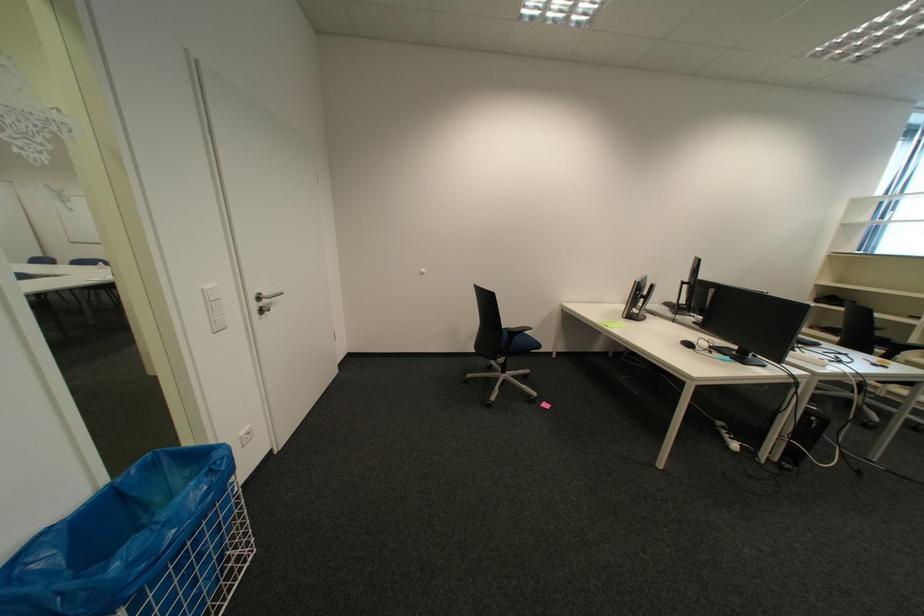
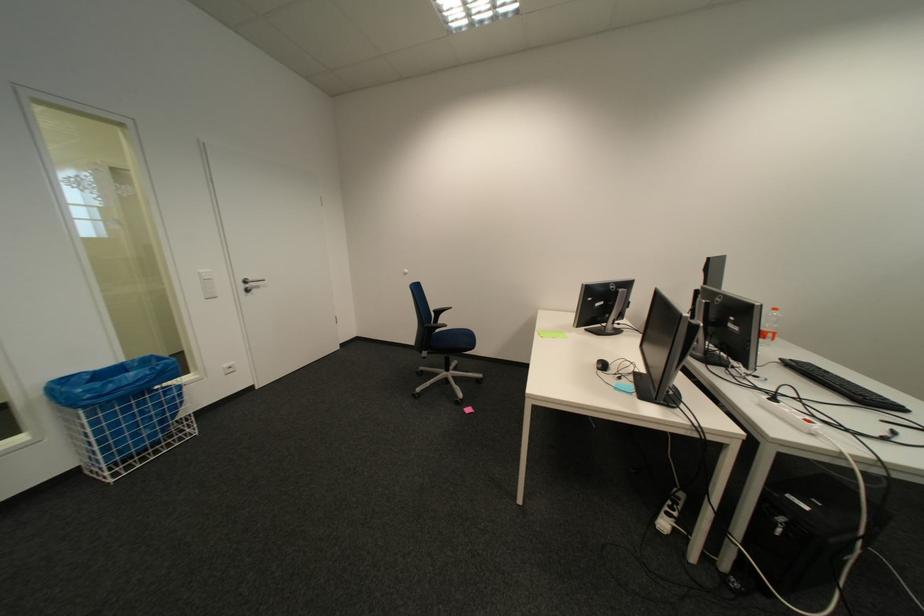
The point at [266,307] is marked in the first image. Where is the corresponding point in the second image?

(254, 286)